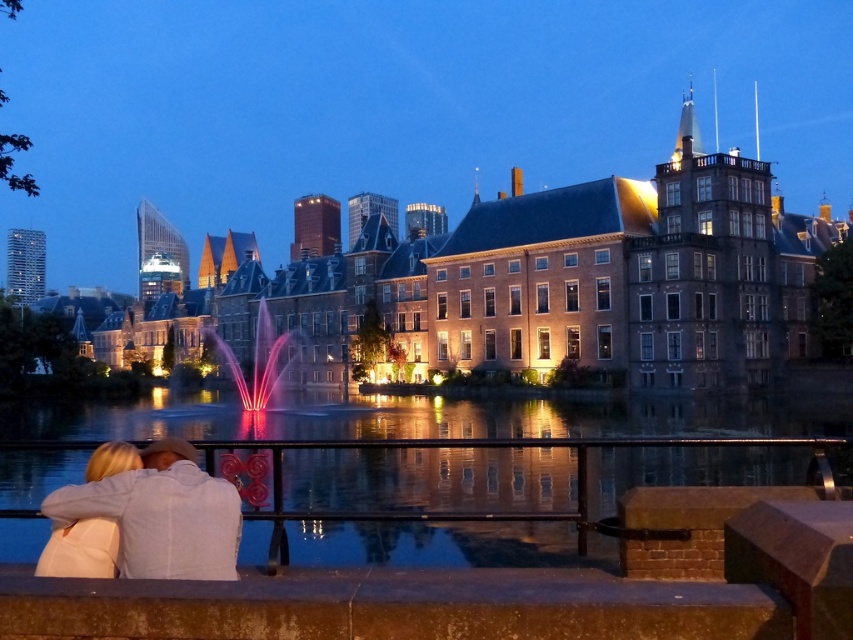
Is reflective glass water at lower center further to the viewer compared to light beige sweater at lower left?

Yes, it is.

Can you confirm if reflective glass water at lower center is wider than light beige sweater at lower left?

Indeed, reflective glass water at lower center has a greater width compared to light beige sweater at lower left.

The width and height of the screenshot is (853, 640). Identify the location of reflective glass water at lower center. (422, 417).

This screenshot has width=853, height=640. I want to click on reflective glass water at lower center, so click(x=422, y=417).

Consider the image. Who is more forward, (670, 403) or (277, 356)?

Point (670, 403) is in front.

Is point (228, 413) positioned before point (259, 304)?

Yes, point (228, 413) is closer to viewer.

The width and height of the screenshot is (853, 640). I want to click on reflective glass water at lower center, so click(422, 417).

Between point (167, 538) and point (273, 342), which one is positioned behind?

Point (273, 342)

Identify the location of light beige sweater at lower left. This screenshot has width=853, height=640. (161, 515).

Who is more distant from viewer, (128,556) or (292,340)?

Positioned behind is point (292,340).

Find the location of a particular element. The height and width of the screenshot is (640, 853). light beige sweater at lower left is located at coordinates (161, 515).